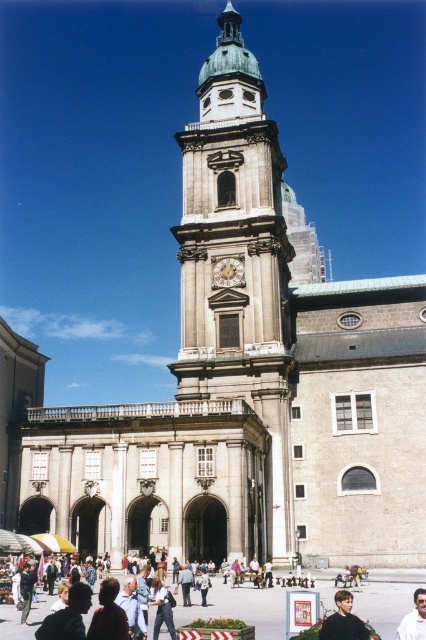
Question: Does white shirt at center come behind light blue denim jeans at center?

Choices:
 (A) no
 (B) yes

Answer: (A)

Question: Which point is closer to the camera taking this photo?

Choices:
 (A) (416, 568)
 (B) (155, 584)
 (C) (342, 625)

Answer: (C)

Question: Is brick paved square at center closer to camera compared to black shirt at lower right?

Choices:
 (A) yes
 (B) no

Answer: (B)

Question: Does brick paved square at center have a larger size compared to gold ornate clock at center?

Choices:
 (A) no
 (B) yes

Answer: (B)

Question: Estimate the real-world distances between objects in this image. Which object is closer to the black shirt at lower right?

Choices:
 (A) gold ornate clock at center
 (B) white shirt at center

Answer: (B)

Question: Which point is farther to the camera?

Choices:
 (A) gold ornate clock at center
 (B) light blue denim jeans at center
 (C) light blue jeans at center

Answer: (A)